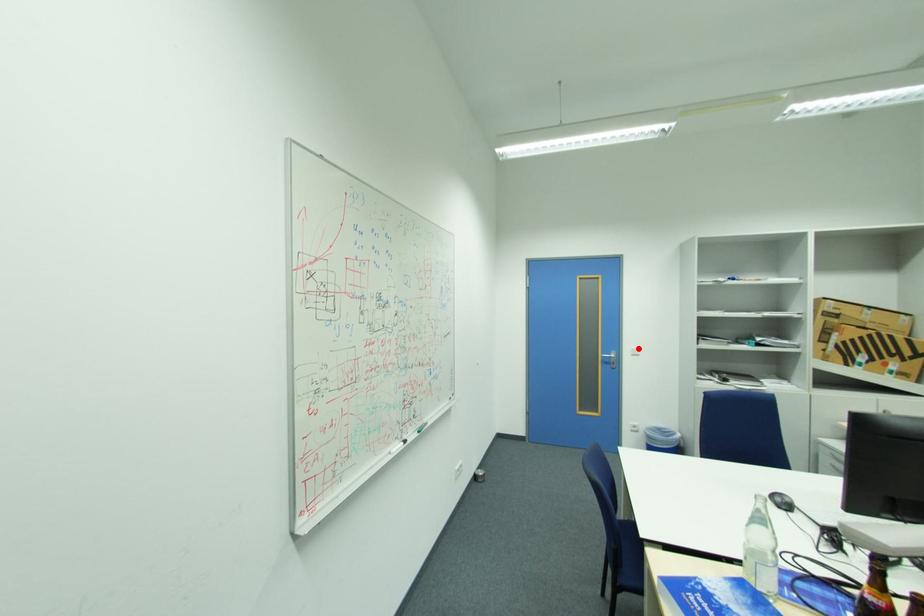
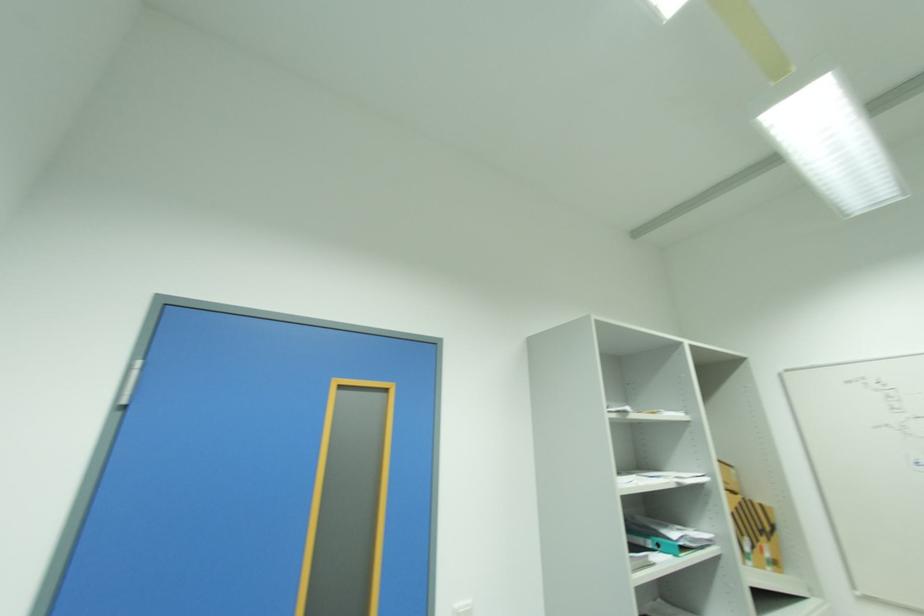
Locate, in the second image, the point that corresponds to the highlighted location in the first image.

(463, 604)